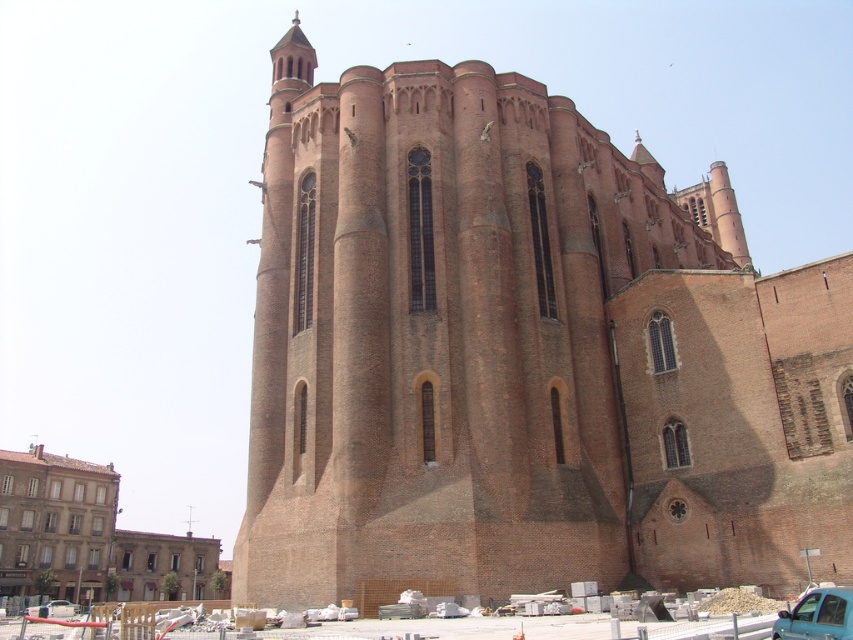
You are a pedestrian standing in front of the brown brick church at lower left and the teal matte car at lower right. Which object is closer to the ground?

The brown brick church at lower left is positioned under the teal matte car at lower right, meaning it is closer to the ground.

You are a delivery driver who needs to park your teal matte car at lower right and metallic silver car at lower left near the historic brick structure. Considering the construction site in front, which car should you park closer to the construction materials to avoid blocking the entrance? Please explain your reasoning based on their sizes.

The teal matte car at lower right has a lesser height compared to the metallic silver car at lower left. To avoid blocking the entrance, the taller metallic silver car at lower left should be parked closer to the construction materials, as it may be more visible over the construction site obstacles, while the shorter teal matte car at lower right can be parked closer to the entrance without obstructing it.

You are standing in front of a historic brick building with construction materials nearby. There is a point marked at coordinates (86, 538). What does this point indicate?

The point at coordinates (86, 538) marks the location of the brown brick church at lower left.